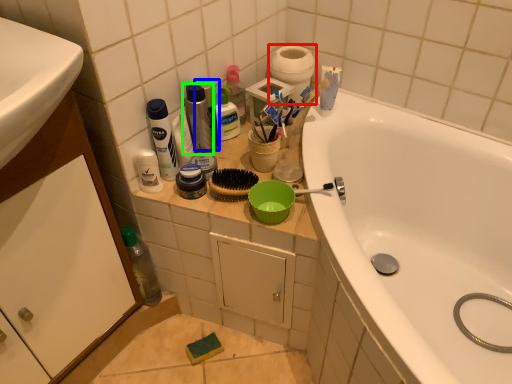
Question: Which is farther away from toilet paper (highlighted by a red box)? personal care (highlighted by a blue box) or cleaning product (highlighted by a green box)?

Choices:
 (A) personal care
 (B) cleaning product

Answer: (B)